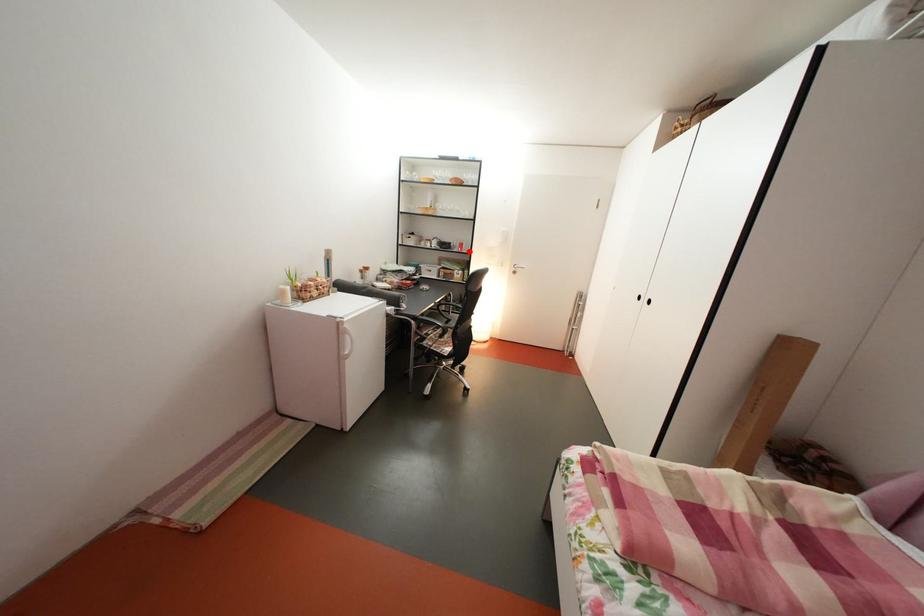
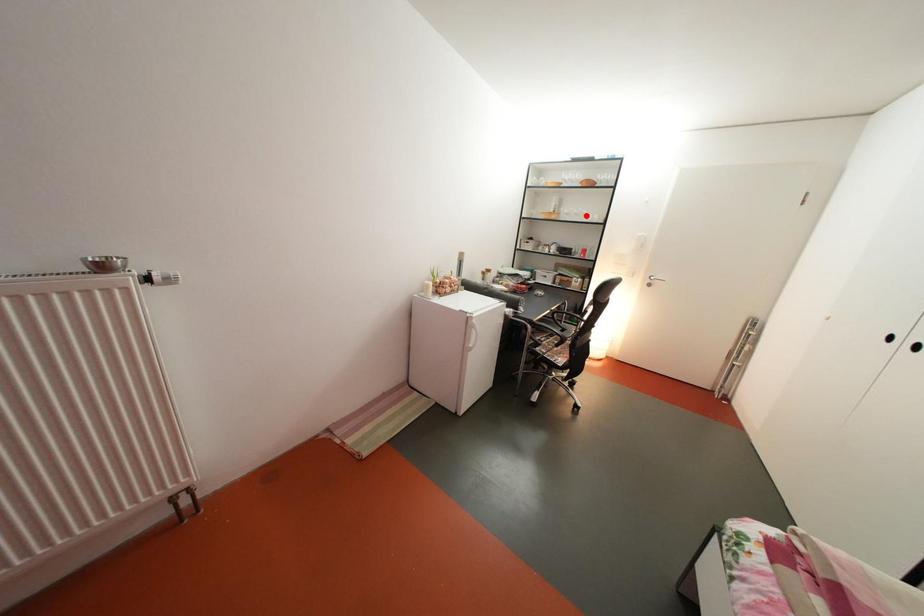
I am providing you with two images of the same scene from different viewpoints. A red point is marked on the first image and another point is marked on the second image. Is the red point in image1 aligned with the point shown in image2?

No